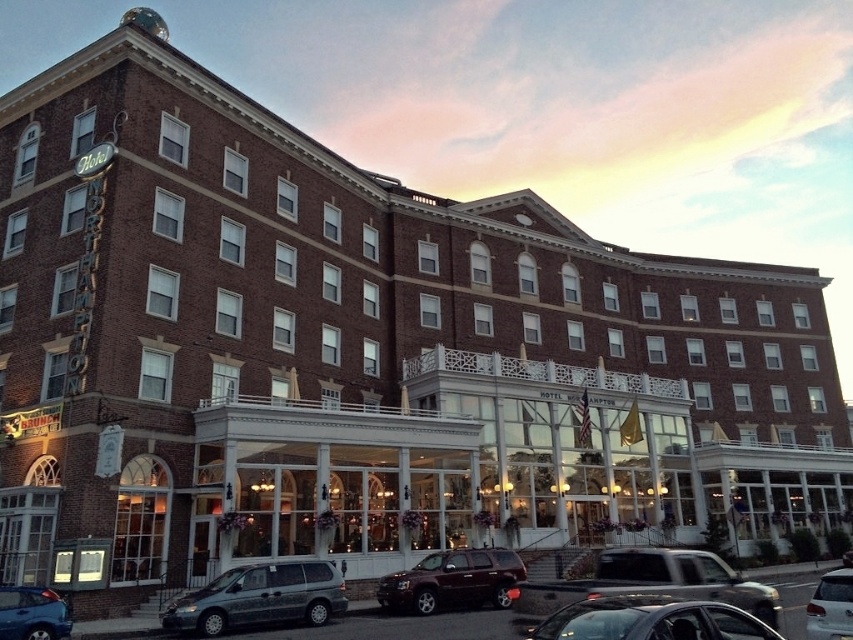
You are standing in front of the Hotel North Hampton and need to park your metallic gray minivan at lower left. The parking spot is located at point (259, 596). Can you safely park your vehicle there without blocking the entrance?

The metallic gray minivan at lower left is located at point (259, 596), so yes, you can park there safely as it is the designated parking spot for the vehicle.

You are standing in front of the Hotel North Hampton and notice two cars parked in front of the building. The metallic blue sedan at lower left and the white glossy sedan at lower right. Which car is positioned more to the left side?

The metallic blue sedan at lower left is positioned more to the left side than the white glossy sedan at lower right.